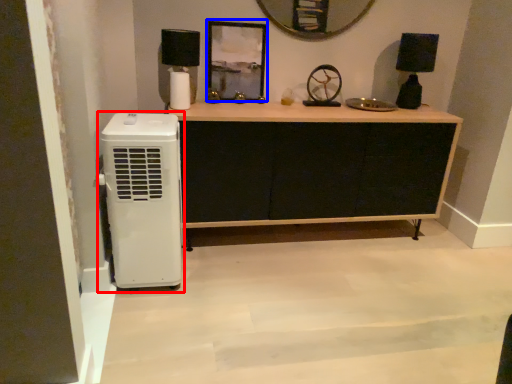
Question: Which object appears farthest to the camera in this image, home appliance (highlighted by a red box) or picture frame (highlighted by a blue box)?

Choices:
 (A) home appliance
 (B) picture frame

Answer: (B)